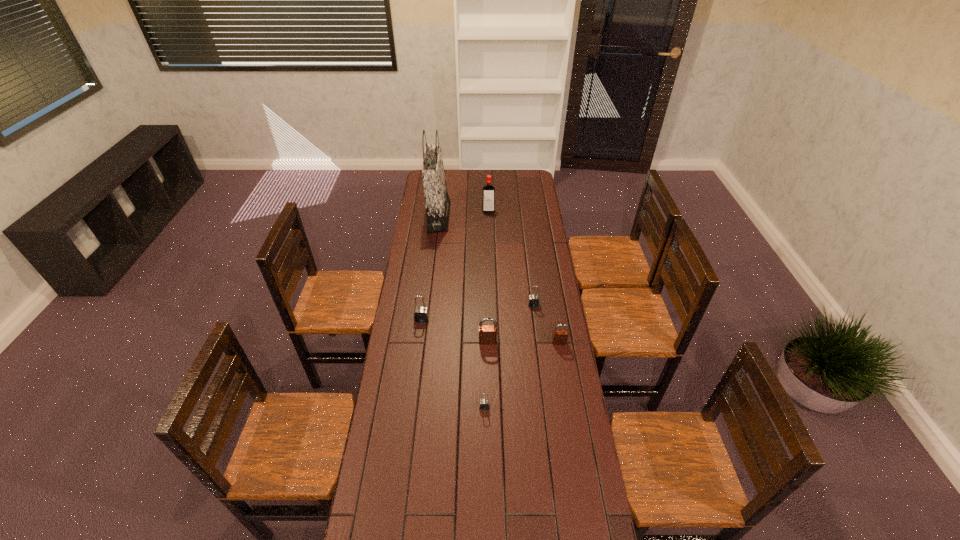
Locate an element on the screen. Image resolution: width=960 pixels, height=540 pixels. object that stands as the second closest to the vodka is located at coordinates (533, 300).

Identify which object is the fifth closest to the rightmost object. Please provide its 2D coordinates. Your answer should be formatted as a tuple, i.e. [(x, y)], where the tuple contains the x and y coordinates of a point satisfying the conditions above.

[(437, 202)]

Identify which padlock is located as the third nearest to the left brown padlock. Please provide its 2D coordinates. Your answer should be formatted as a tuple, i.e. [(x, y)], where the tuple contains the x and y coordinates of a point satisfying the conditions above.

[(421, 314)]

The width and height of the screenshot is (960, 540). I want to click on padlock that is the closest one to the second gray padlock from right to left, so click(487, 333).

Locate an element on the screen. The height and width of the screenshot is (540, 960). gray padlock that can be found as the second closest to the leftmost gray padlock is located at coordinates (484, 404).

Identify the location of the third closest gray padlock to the right brown padlock. The width and height of the screenshot is (960, 540). (421, 314).

Locate an element on the screen. brown padlock that is the second nearest to the second smallest gray padlock is located at coordinates (487, 333).

I want to click on brown padlock that can be found as the second closest to the shortest padlock, so click(x=560, y=337).